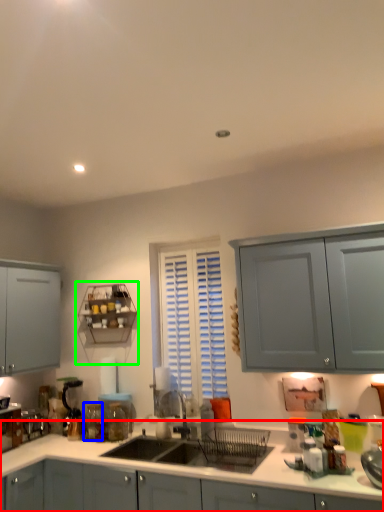
Question: Based on their relative distances, which object is farther from cabinetry (highlighted by a red box)? Choose from glass jar (highlighted by a blue box) and shelf (highlighted by a green box).

Choices:
 (A) glass jar
 (B) shelf

Answer: (B)